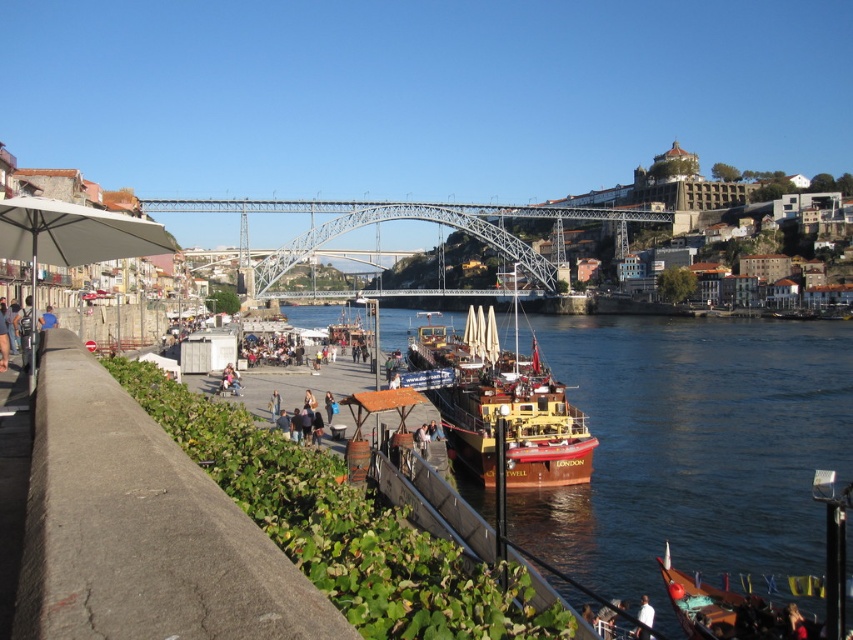
You are a pedestrian wearing a light brown leather jacket at center and want to cross the metallic steel bridge at center. Which direction should you walk to reach the bridge?

The metallic steel bridge at center is positioned on the right side of the light brown leather jacket at center, so you should walk to your right to reach the bridge.

Consider the image. You are standing at the point marked by the coordinates (x=693, y=449) in the image. What object are you directly facing?

The point marked by the coordinates (x=693, y=449) directly faces the brown wooden boat at center.

How far apart are the two ends of the metallic steel bridge at center?

The two ends of the metallic steel bridge at center are 518.63 feet apart.